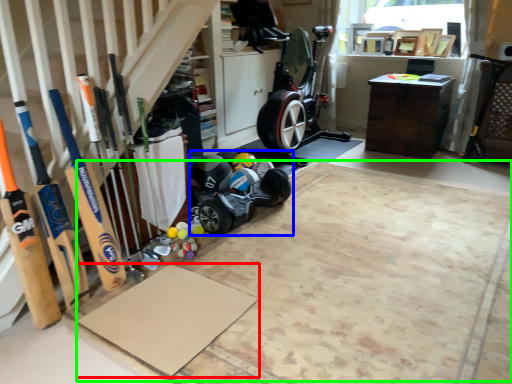
Question: Which is nearer to the yoga mat (highlighted by a red box)? baby carriage (highlighted by a blue box) or yoga mat (highlighted by a green box).

Choices:
 (A) baby carriage
 (B) yoga mat

Answer: (B)